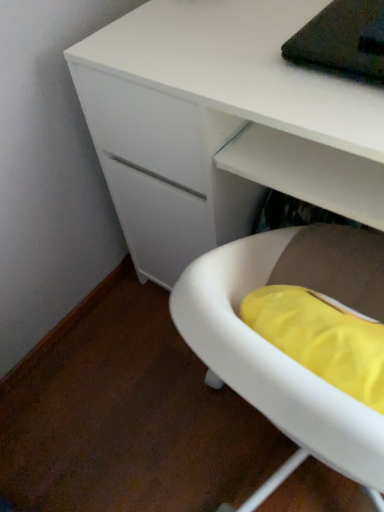
Question: Relative to white matte desk at center, is white plastic tub at lower right in front or behind?

Choices:
 (A) front
 (B) behind

Answer: (A)

Question: Does point (379, 417) appear closer or farther from the camera than point (279, 10)?

Choices:
 (A) closer
 (B) farther

Answer: (A)

Question: Considering the positions of white plastic tub at lower right and white matte desk at center in the image, is white plastic tub at lower right wider or thinner than white matte desk at center?

Choices:
 (A) wide
 (B) thin

Answer: (B)

Question: From a real-world perspective, is white matte desk at center physically located above or below white plastic tub at lower right?

Choices:
 (A) above
 (B) below

Answer: (B)

Question: Relative to white plastic tub at lower right, is white matte desk at center in front or behind?

Choices:
 (A) front
 (B) behind

Answer: (B)

Question: Is white matte desk at center taller or shorter than white plastic tub at lower right?

Choices:
 (A) tall
 (B) short

Answer: (A)

Question: In terms of width, does white matte desk at center look wider or thinner when compared to white plastic tub at lower right?

Choices:
 (A) wide
 (B) thin

Answer: (A)